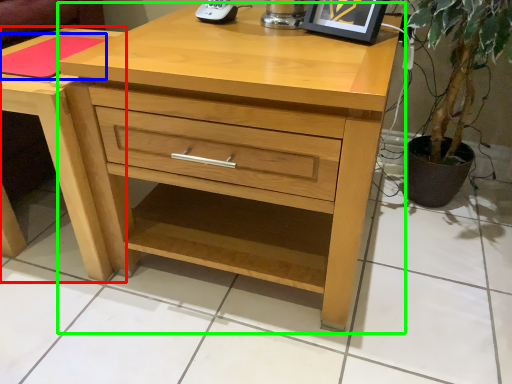
Question: Based on their relative distances, which object is farther from nightstand (highlighted by a red box)? Choose from pad (highlighted by a blue box) and chest of drawers (highlighted by a green box).

Choices:
 (A) pad
 (B) chest of drawers

Answer: (B)